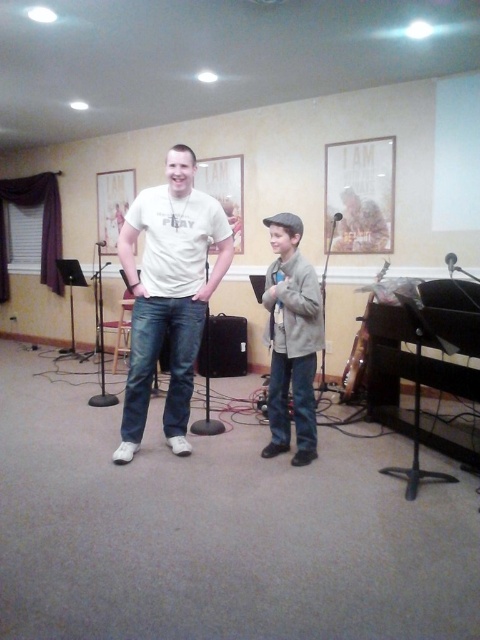
You are standing in the room and want to hand a microphone to the person wearing the light brown leather jacket at center without disturbing the black plastic speaker at center. Which object should you move closer to first?

You should move closer to the light brown leather jacket at center first because it is closer to the viewer than the black plastic speaker at center, making it easier to reach without disturbing the speaker.

You are standing in the room and want to place a small plant on the light brown leather jacket at center. Can you confirm the jacket is on the floor or hanging somewhere?

The light brown leather jacket at center is located at point coordinates, so it is likely hanging or placed on a surface, but the exact position isn t specified. However, based on typical scenarios, jackets are often hung or placed on surfaces like chairs, not on the floor. So the jacket is probably not on the floor.